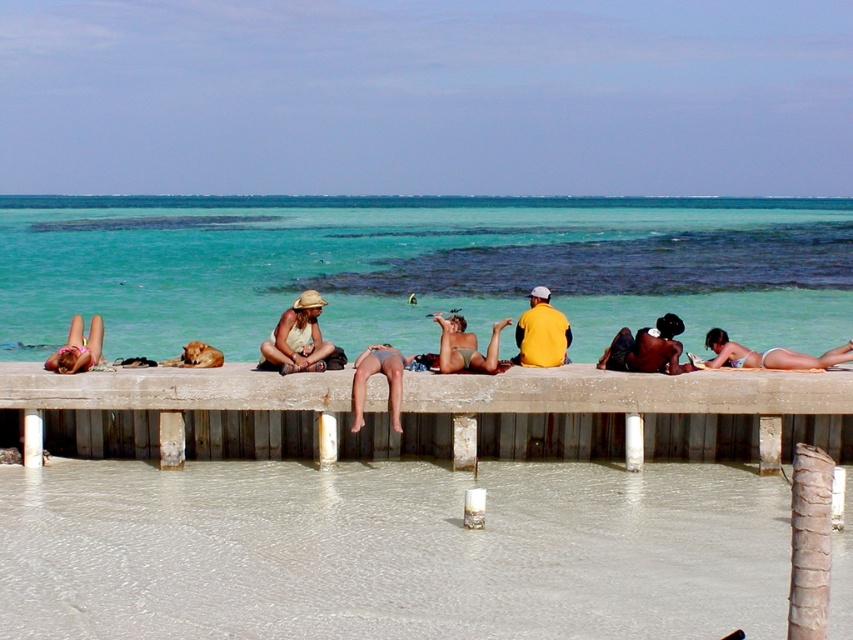
Who is more forward, (x=415, y=404) or (x=282, y=348)?

Point (x=415, y=404) is in front.

Does concrete pier at center appear over matte beige hat at center?

Actually, concrete pier at center is below matte beige hat at center.

Where is `concrete pier at center`? concrete pier at center is located at coordinates (432, 413).

Image resolution: width=853 pixels, height=640 pixels. I want to click on smooth concrete surface at lower center, so click(392, 550).

Identify the location of smooth concrete surface at lower center. (392, 550).

Which is more to the right, clear blue water at center or shiny black skin at center?

shiny black skin at center

Does point (344, 307) come behind point (653, 330)?

Yes.

You are a GUI agent. You are given a task and a screenshot of the screen. Output one action in this format:
    pyautogui.click(x=<x>, y=<y>)
    Task: Click on the clear blue water at center
    Image resolution: width=853 pixels, height=640 pixels.
    Given the screenshot: What is the action you would take?
    pyautogui.click(x=418, y=268)

I want to click on clear blue water at center, so click(418, 268).